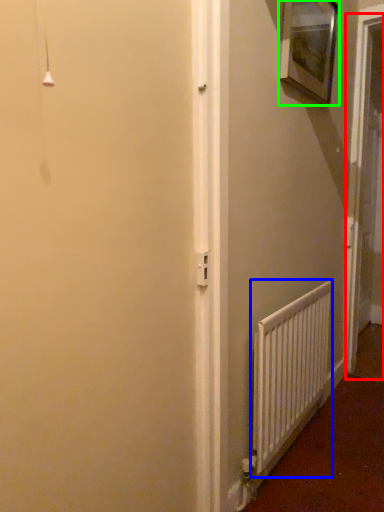
Question: Considering the real-world distances, which object is farthest from screen door (highlighted by a red box)? radiator (highlighted by a blue box) or picture frame (highlighted by a green box)?

Choices:
 (A) radiator
 (B) picture frame

Answer: (A)